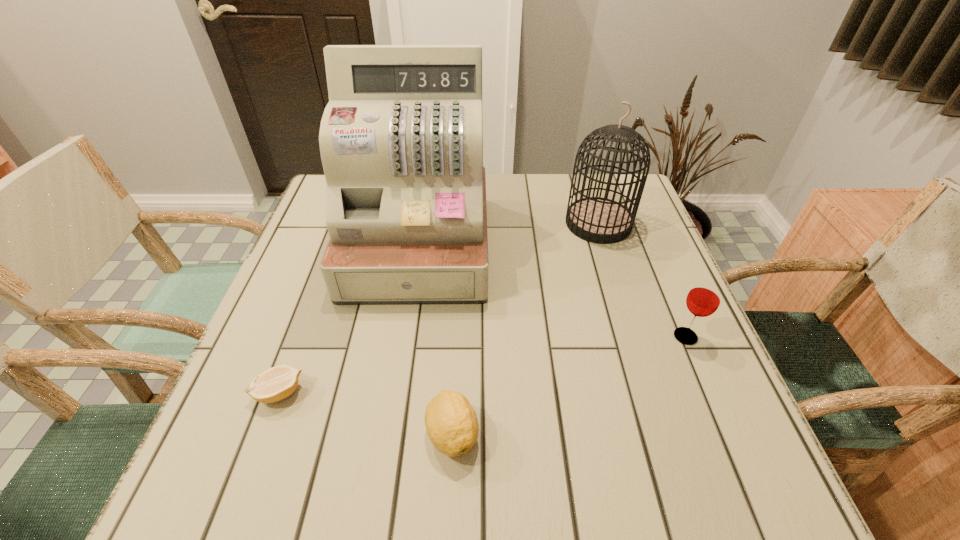
Find the location of a particular element. The image size is (960, 540). free location located 0.330m on the back of the glass is located at coordinates (639, 229).

This screenshot has height=540, width=960. I want to click on free space located 0.390m on the back of the shortest object, so click(x=334, y=244).

Identify the location of cash register that is at the far edge. This screenshot has width=960, height=540. (401, 139).

Where is `birdcage present at the far edge`? This screenshot has width=960, height=540. birdcage present at the far edge is located at coordinates (599, 220).

The width and height of the screenshot is (960, 540). I want to click on object located in the near edge section of the desktop, so click(x=451, y=423).

What are the coordinates of `cash register that is at the left edge` in the screenshot? It's located at (401, 139).

Where is `lemon present at the left edge`? lemon present at the left edge is located at coordinates (277, 383).

The height and width of the screenshot is (540, 960). I want to click on birdcage that is at the right edge, so point(599,220).

Find the location of a particular element. This screenshot has height=540, width=960. glass present at the right edge is located at coordinates (704, 298).

Locate an element on the screen. The image size is (960, 540). object at the far left corner is located at coordinates (401, 139).